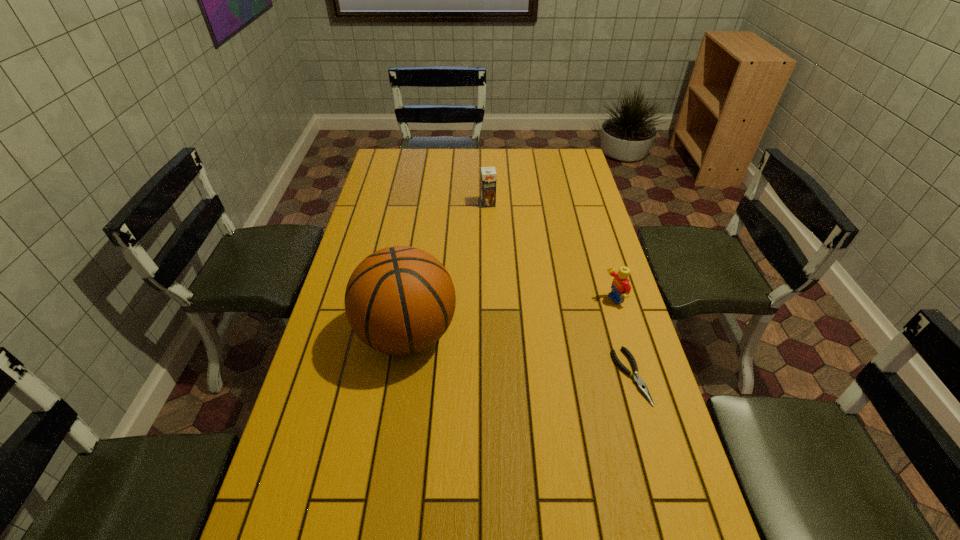
Locate an element on the screen. free space at the right edge is located at coordinates (622, 440).

The height and width of the screenshot is (540, 960). Identify the location of vacant space at the far right corner of the desktop. (566, 167).

Locate an element on the screen. The image size is (960, 540). vacant area between the pliers and the Lego is located at coordinates (622, 338).

Where is `unoccupied position between the Lego and the shortest object`? The width and height of the screenshot is (960, 540). unoccupied position between the Lego and the shortest object is located at coordinates (622, 338).

This screenshot has height=540, width=960. In order to click on empty space between the leftmost object and the shortest object in this screenshot , I will do `click(518, 355)`.

In order to click on free space between the third object from right to left and the shortest object in this screenshot , I will do `click(560, 290)`.

Where is `free area in between the second object from left to right and the tallest object`? This screenshot has width=960, height=540. free area in between the second object from left to right and the tallest object is located at coordinates (447, 268).

What are the coordinates of `empty space between the basketball and the pliers` in the screenshot? It's located at (518, 355).

This screenshot has height=540, width=960. Find the location of `empty space that is in between the third shortest object and the Lego`. empty space that is in between the third shortest object and the Lego is located at coordinates (550, 252).

The height and width of the screenshot is (540, 960). I want to click on vacant space that is in between the pliers and the second shortest object, so [x=622, y=338].